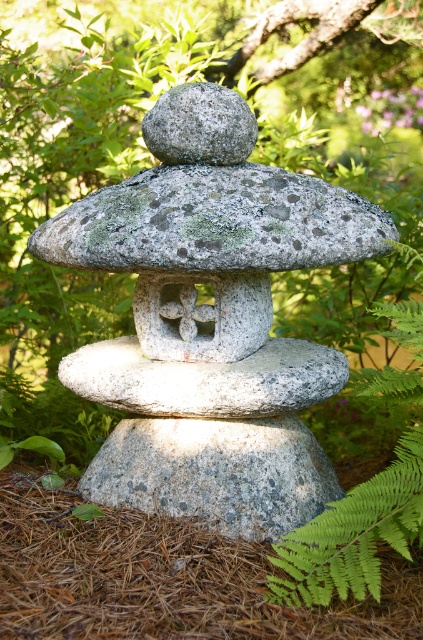
Between white textured stone at center and gray rough stone at center, which one is positioned lower?

Positioned lower is white textured stone at center.

Locate an element on the screen. white textured stone at center is located at coordinates (206, 380).

Locate an element on the screen. This screenshot has width=423, height=640. white textured stone at center is located at coordinates (206, 380).

Is gray/granite stone at center to the right of white textured stone at center from the viewer's perspective?

Yes, gray/granite stone at center is to the right of white textured stone at center.

Locate an element on the screen. gray/granite stone at center is located at coordinates (216, 472).

This screenshot has width=423, height=640. In order to click on gray/granite stone at center in this screenshot , I will do `click(216, 472)`.

Is gray/granite stone at center shorter than gray rough stone at center?

No, gray/granite stone at center is not shorter than gray rough stone at center.

Is point (230, 448) positioned in front of point (220, 156)?

That is True.

Where is `gray/granite stone at center`? gray/granite stone at center is located at coordinates (216, 472).